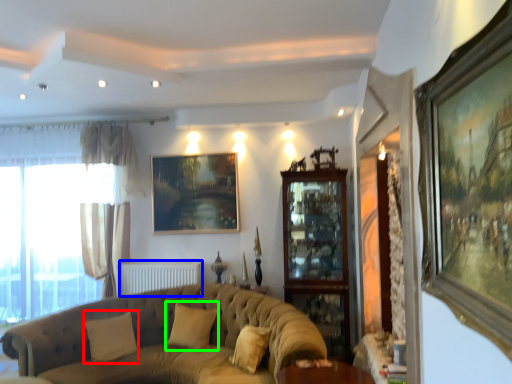
Question: Considering the real-world distances, which object is closest to pillow (highlighted by a red box)? radiator (highlighted by a blue box) or pillow (highlighted by a green box).

Choices:
 (A) radiator
 (B) pillow

Answer: (B)